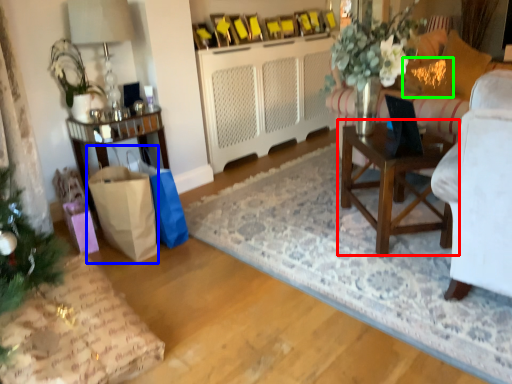
Question: Considering the real-world distances, which object is farthest from table (highlighted by a red box)? shopping bag (highlighted by a blue box) or pillow (highlighted by a green box)?

Choices:
 (A) shopping bag
 (B) pillow

Answer: (A)